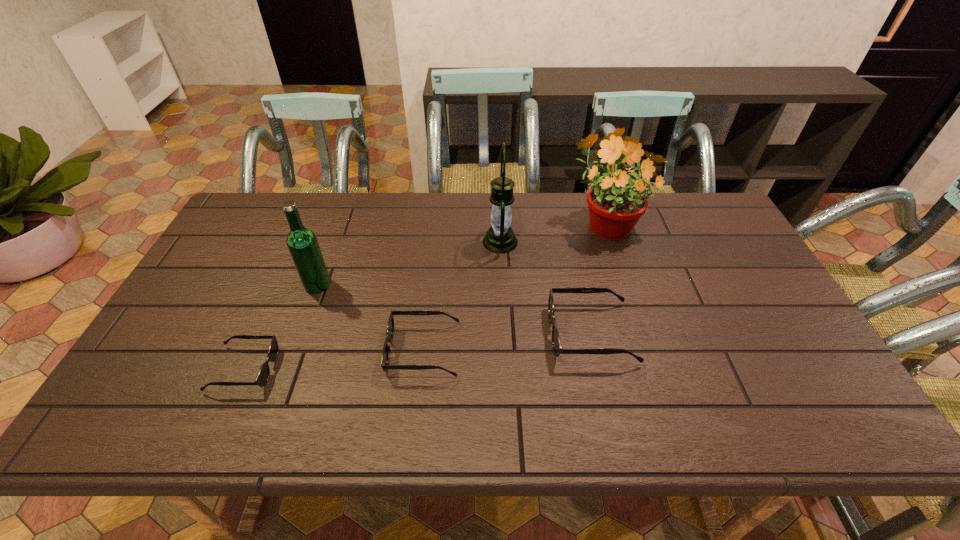
Locate an element on the screen. The width and height of the screenshot is (960, 540). object that can be found as the second closest to the fourth nearest object is located at coordinates (390, 327).

Where is `object that can be found as the second closest to the beer bottle`? This screenshot has height=540, width=960. object that can be found as the second closest to the beer bottle is located at coordinates (390, 327).

Locate which sunglasses is the closest to the third object from right to left. Please provide its 2D coordinates. Your answer should be formatted as a tuple, i.e. [(x, y)], where the tuple contains the x and y coordinates of a point satisfying the conditions above.

[(556, 344)]

Choose which sunglasses is the second nearest neighbor to the second shortest sunglasses. Please provide its 2D coordinates. Your answer should be formatted as a tuple, i.e. [(x, y)], where the tuple contains the x and y coordinates of a point satisfying the conditions above.

[(263, 375)]